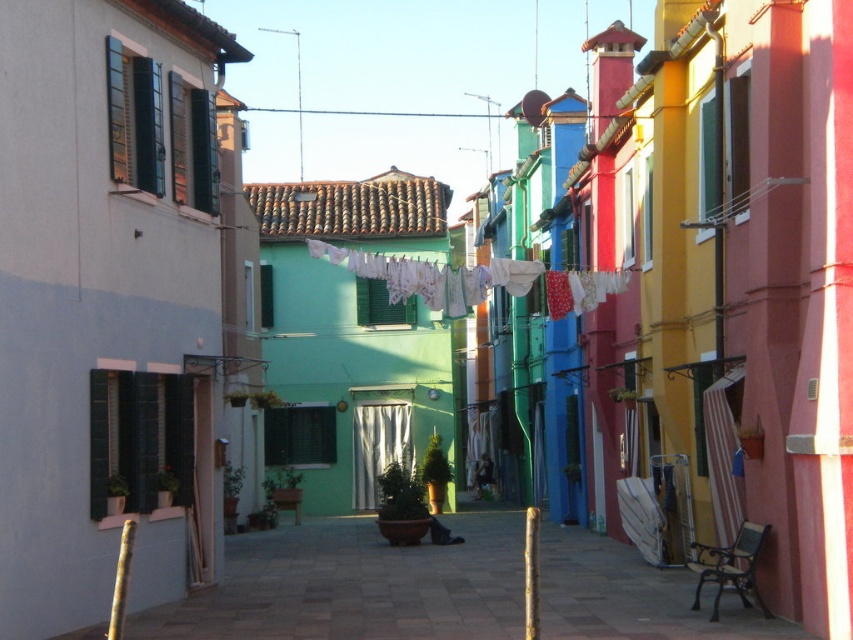
Who is positioned more to the right, smooth concrete alley at center or white fabric clothesline at center?

smooth concrete alley at center is more to the right.

The height and width of the screenshot is (640, 853). What do you see at coordinates (357, 586) in the screenshot? I see `smooth concrete alley at center` at bounding box center [357, 586].

Image resolution: width=853 pixels, height=640 pixels. I want to click on smooth concrete alley at center, so click(357, 586).